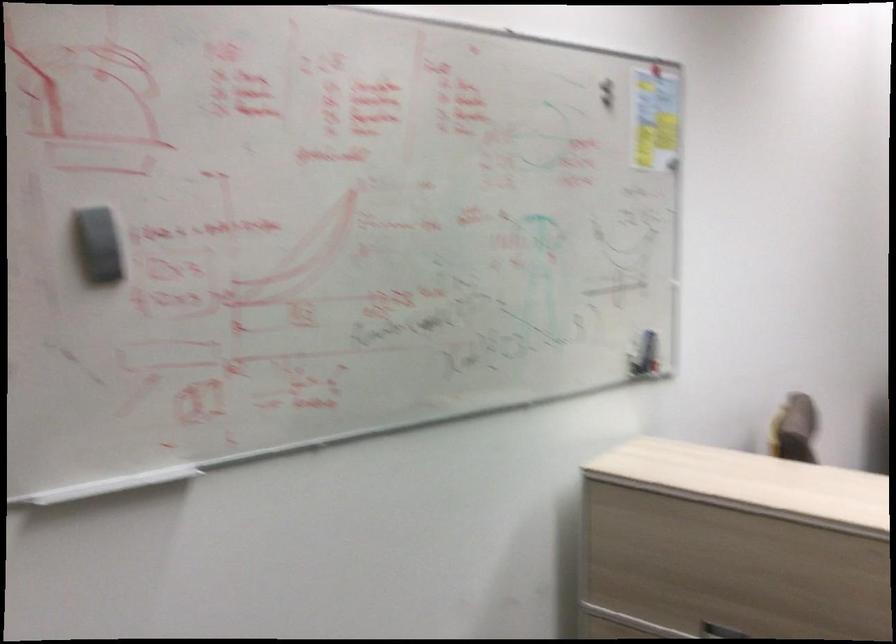
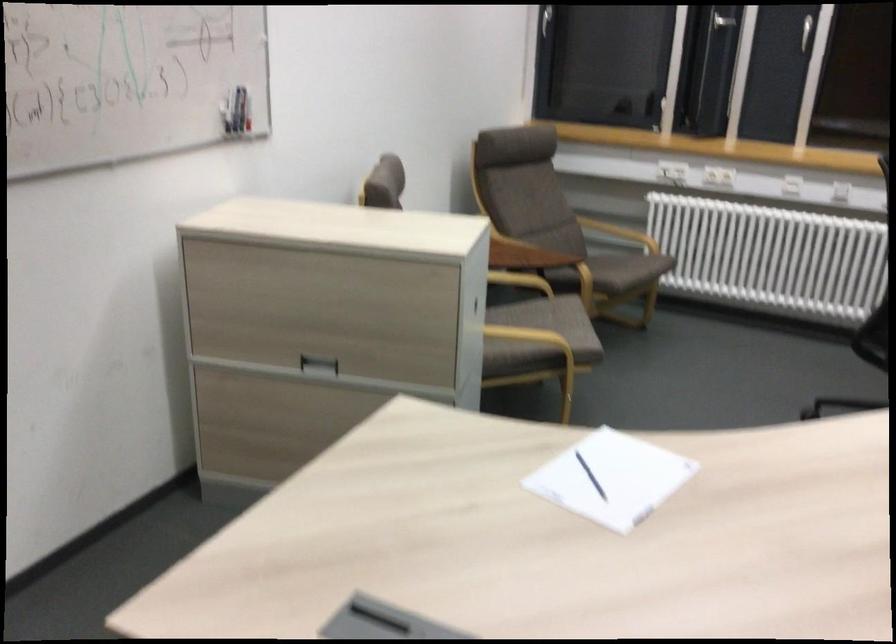
Locate, in the second image, the point that corresponds to [642,348] in the first image.

(228, 111)